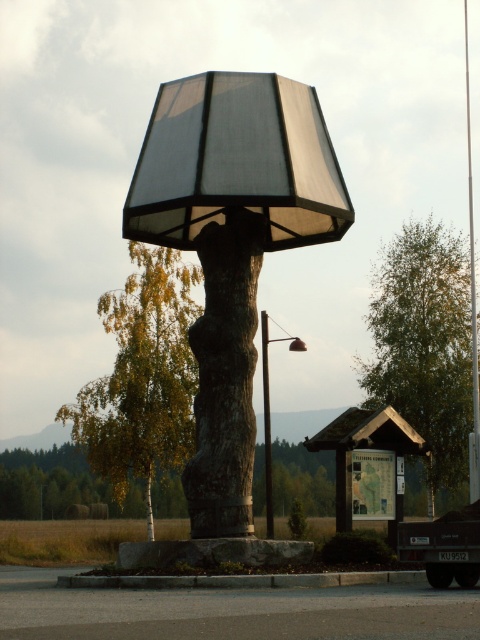
What do you see at coordinates (471, 300) in the screenshot?
I see `metallic pole at center` at bounding box center [471, 300].

Can you confirm if metallic pole at center is positioned above matte black pole at center?

Correct, metallic pole at center is located above matte black pole at center.

Does point (470, 156) lie behind point (265, 316)?

That is True.

Find the location of a particular element. metallic pole at center is located at coordinates (471, 300).

Between rough bark tree trunk at center and matte black pole at center, which one has more height?

matte black pole at center

Who is positioned more to the left, rough bark tree trunk at center or matte black pole at center?

rough bark tree trunk at center

The image size is (480, 640). In order to click on rough bark tree trunk at center in this screenshot , I will do `click(225, 378)`.

Image resolution: width=480 pixels, height=640 pixels. In order to click on rough bark tree trunk at center in this screenshot , I will do `click(225, 378)`.

Who is positioned more to the left, green leafy tree at center or matte black pole at center?

From the viewer's perspective, green leafy tree at center appears more on the left side.

This screenshot has height=640, width=480. Describe the element at coordinates (142, 378) in the screenshot. I see `green leafy tree at center` at that location.

The width and height of the screenshot is (480, 640). Find the location of `green leafy tree at center`. green leafy tree at center is located at coordinates (142, 378).